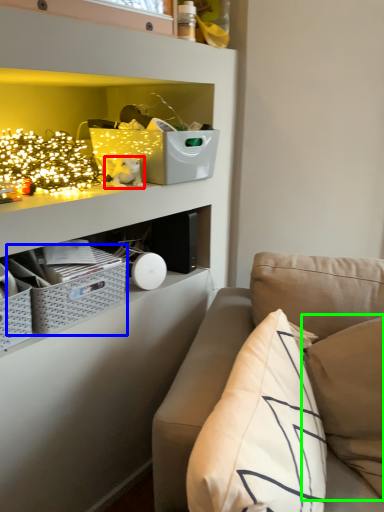
Question: Based on their relative distances, which object is nearer to toy (highlighted by a red box)? Choose from crate (highlighted by a blue box) and pillow (highlighted by a green box).

Choices:
 (A) crate
 (B) pillow

Answer: (A)